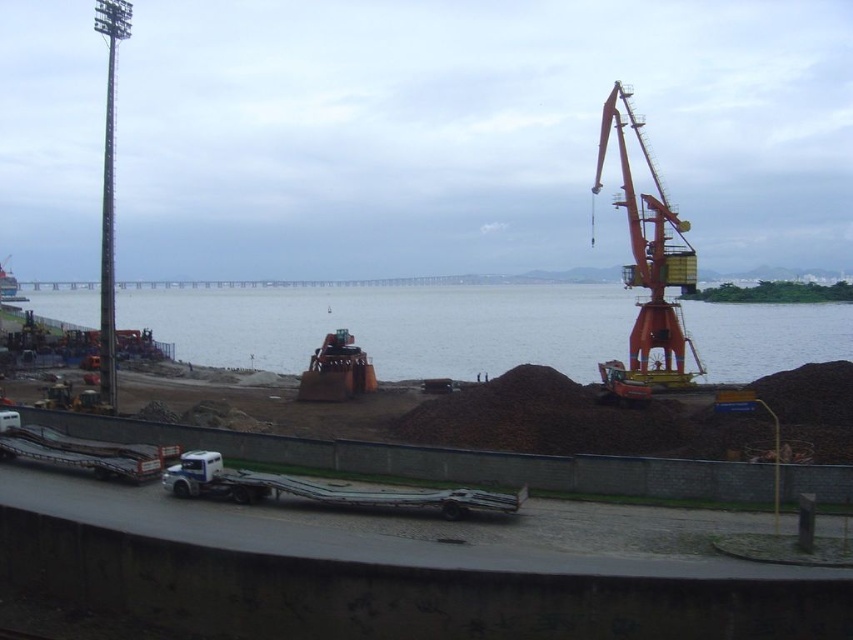
You are a delivery driver who needs to maneuver your truck into a loading bay. The orange metallic crane at right is blocking your path. Can you safely move around it to reach the white metallic trailer truck at lower center?

The orange metallic crane at right has a larger size compared to the white metallic trailer truck at lower center, so you need to ensure there is enough space to navigate around the crane to reach the trailer truck. However, without specific clearance details, it is recommended to assess the available space carefully before attempting to maneuver.

You are standing at the camera position looking at the industrial waterfront scene. There is a point at coordinates point (668, 262). Can you tell me how far this point is from where you are standing?

The point at point (668, 262) is 223.20 feet away from the camera position.

You are a delivery driver who needs to transport a 100 meter long cargo from the metallic orange boat at left to the blue water at center. Can you make the delivery without needing to adjust the cargo length?

The distance between the metallic orange boat at left and the blue water at center is 82.48 meters. Since the cargo is 100 meters long, it is longer than the available space. Therefore, you would need to adjust the cargo length to fit within the 82.48 meters distance.